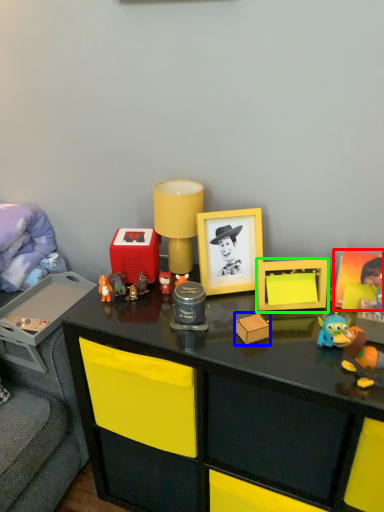
Question: Estimate the real-world distances between objects in this image. Which object is closer to picture frame (highlighted by a red box), toy (highlighted by a blue box) or toy (highlighted by a green box)?

Choices:
 (A) toy
 (B) toy

Answer: (B)